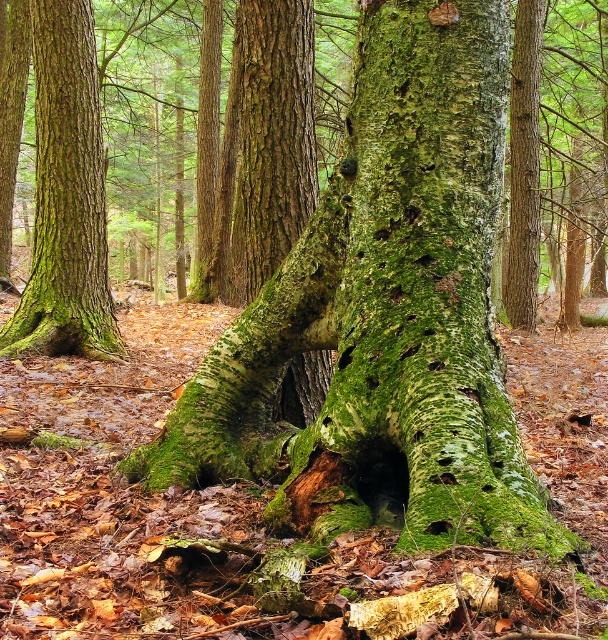
You are hiking in the forest and want to take a photo of both the green mossy tree trunk at left and the green mossy tree trunk at center. Which trunk should you move closer to in order to capture both in your camera frame?

You should move closer to the green mossy tree trunk at center because it is farther away from you than the green mossy tree trunk at left. By moving closer to the center trunk, you can better frame both trunks within your camera view.

Looking at this image, you are standing at the point labeled point (66, 196) in the forest scene. Looking around, you notice the green mossy tree trunk at left. Based on your position, which direction should you walk to reach the green mossy tree trunk at left?

Since you are at point (66, 196), which represents the green mossy tree trunk at left, you are already at the location of the green mossy tree trunk at left. Therefore, you don not need to walk anywhere else.